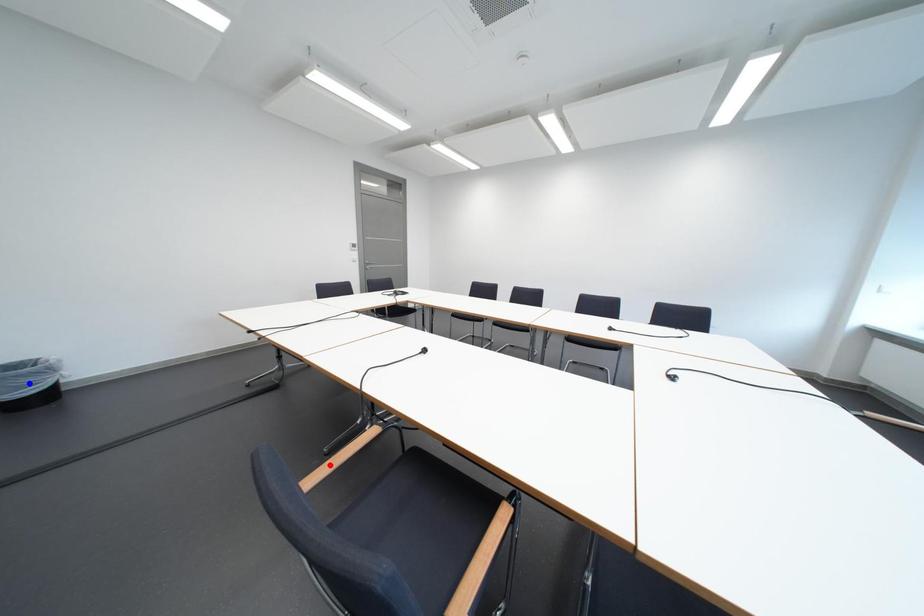
Question: In the image, two points are highlighted. Which point is nearer to the camera? Reply with the corresponding letter.

Choices:
 (A) blue point
 (B) red point

Answer: (A)